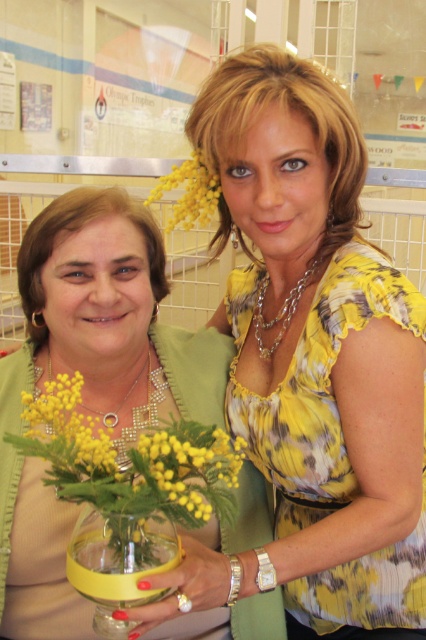
Can you confirm if matte green dress at center is taller than yellow matte flowers at center?

Yes.

Where is `matte green dress at center`? The width and height of the screenshot is (426, 640). matte green dress at center is located at coordinates (98, 307).

Does matte green dress at center have a greater width compared to yellow fluffy flower at upper center?

Yes.

Is matte green dress at center further to camera compared to yellow fluffy flower at upper center?

No, it is in front of yellow fluffy flower at upper center.

Locate an element on the screen. This screenshot has height=640, width=426. matte green dress at center is located at coordinates (98, 307).

Where is `matte green dress at center`? The width and height of the screenshot is (426, 640). matte green dress at center is located at coordinates point(98,307).

Between yellow matte flowers at center and yellow fluffy flower at upper center, which one has more height?

With more height is yellow fluffy flower at upper center.

Does yellow matte flowers at center appear on the left side of yellow fluffy flower at upper center?

Correct, you'll find yellow matte flowers at center to the left of yellow fluffy flower at upper center.

Who is more distant from viewer, (63, 403) or (175, 173)?

Point (175, 173)

This screenshot has height=640, width=426. What are the coordinates of `yellow matte flowers at center` in the screenshot? It's located at (131, 460).